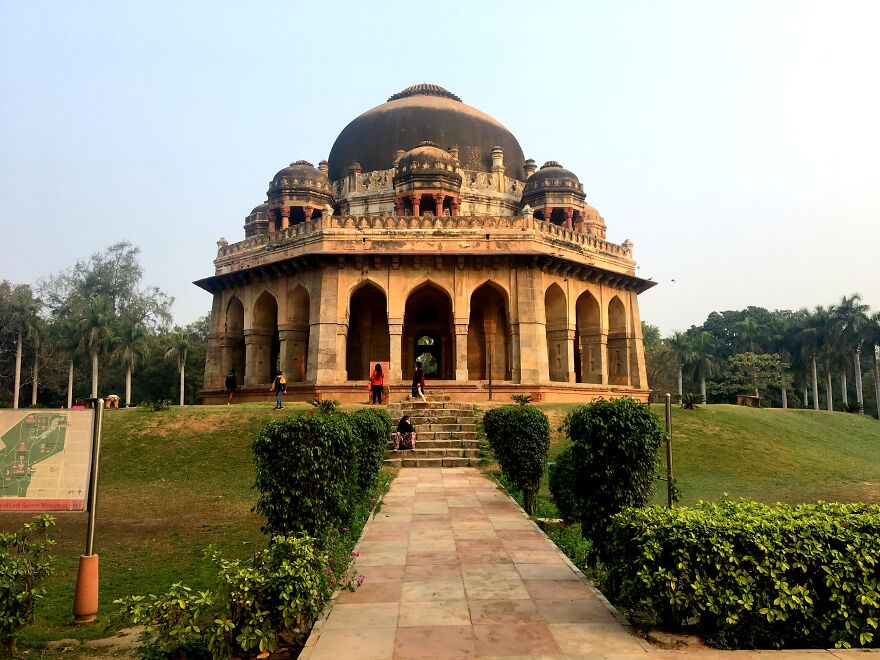
Where is `brown stairsteps`? brown stairsteps is located at coordinates (435, 461), (438, 451), (443, 439), (443, 431), (444, 420), (444, 409).